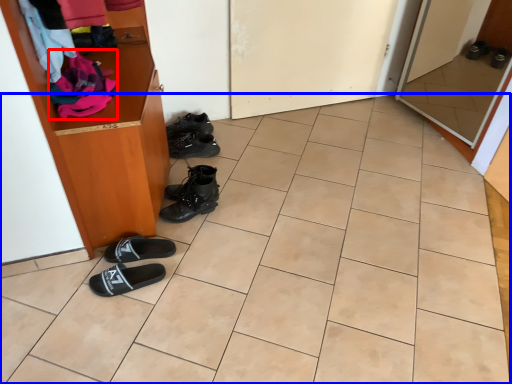
Question: Among these objects, which one is farthest to the camera, clothing (highlighted by a red box) or tile (highlighted by a blue box)?

Choices:
 (A) clothing
 (B) tile

Answer: (A)